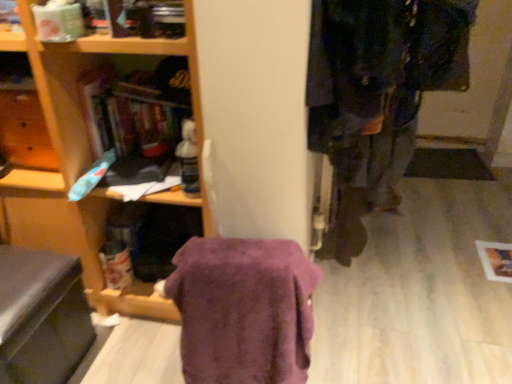
Question: Is black leather swivel chair at lower left taller than purple fuzzy blanket at center?

Choices:
 (A) no
 (B) yes

Answer: (A)

Question: From the image's perspective, would you say black leather swivel chair at lower left is positioned over purple fuzzy blanket at center?

Choices:
 (A) yes
 (B) no

Answer: (B)

Question: Considering the relative sizes of black leather swivel chair at lower left and purple fuzzy blanket at center in the image provided, is black leather swivel chair at lower left shorter than purple fuzzy blanket at center?

Choices:
 (A) no
 (B) yes

Answer: (B)

Question: Considering the relative positions of black leather swivel chair at lower left and purple fuzzy blanket at center in the image provided, is black leather swivel chair at lower left to the right of purple fuzzy blanket at center from the viewer's perspective?

Choices:
 (A) yes
 (B) no

Answer: (B)

Question: Is black leather swivel chair at lower left facing towards purple fuzzy blanket at center?

Choices:
 (A) yes
 (B) no

Answer: (A)

Question: Looking at the image, does dark blue fabric coat at right seem bigger or smaller compared to purple fuzzy blanket at center?

Choices:
 (A) small
 (B) big

Answer: (B)

Question: Is dark blue fabric coat at right to the left or to the right of purple fuzzy blanket at center in the image?

Choices:
 (A) right
 (B) left

Answer: (A)

Question: Would you say dark blue fabric coat at right is inside or outside purple fuzzy blanket at center?

Choices:
 (A) outside
 (B) inside

Answer: (A)

Question: From a real-world perspective, is dark blue fabric coat at right above or below purple fuzzy blanket at center?

Choices:
 (A) below
 (B) above

Answer: (B)

Question: Looking at their shapes, would you say dark blue fabric coat at right is wider or thinner than black leather swivel chair at lower left?

Choices:
 (A) wide
 (B) thin

Answer: (A)

Question: Is dark blue fabric coat at right spatially inside black leather swivel chair at lower left, or outside of it?

Choices:
 (A) outside
 (B) inside

Answer: (A)

Question: In terms of size, does dark blue fabric coat at right appear bigger or smaller than black leather swivel chair at lower left?

Choices:
 (A) big
 (B) small

Answer: (A)

Question: In the image, is dark blue fabric coat at right positioned in front of or behind black leather swivel chair at lower left?

Choices:
 (A) behind
 (B) front

Answer: (B)

Question: Looking at the image, does purple fuzzy blanket at center seem bigger or smaller compared to dark blue fabric coat at right?

Choices:
 (A) big
 (B) small

Answer: (B)

Question: From the image's perspective, is purple fuzzy blanket at center located above or below dark blue fabric coat at right?

Choices:
 (A) below
 (B) above

Answer: (A)